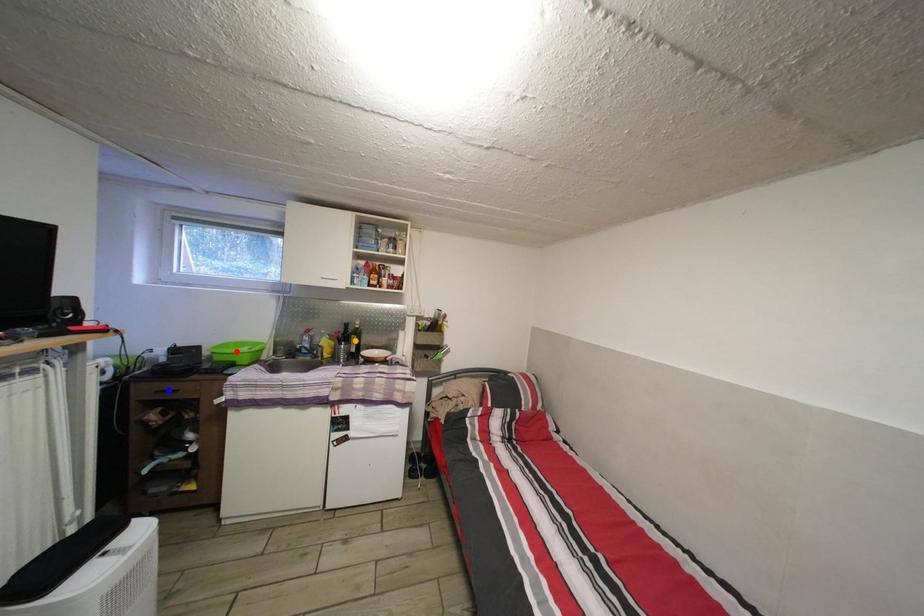
Order these from farthest to nearest:
- orange point
- blue point
- red point

1. orange point
2. red point
3. blue point